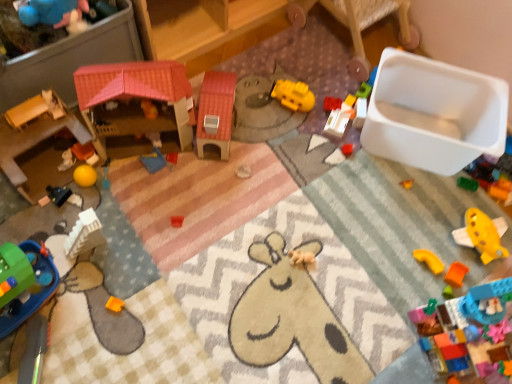
At what (x,y) coordinates should I click in order to perform the action: click on vacant space that's between yellow matte plastic toy at center, which is the 8th toy from left to right, and black plastic toy at lower left, arranged as the 3th toy when viewed from the left. Please return your answer as a coordinate pair (x, y). Looking at the image, I should click on (200, 145).